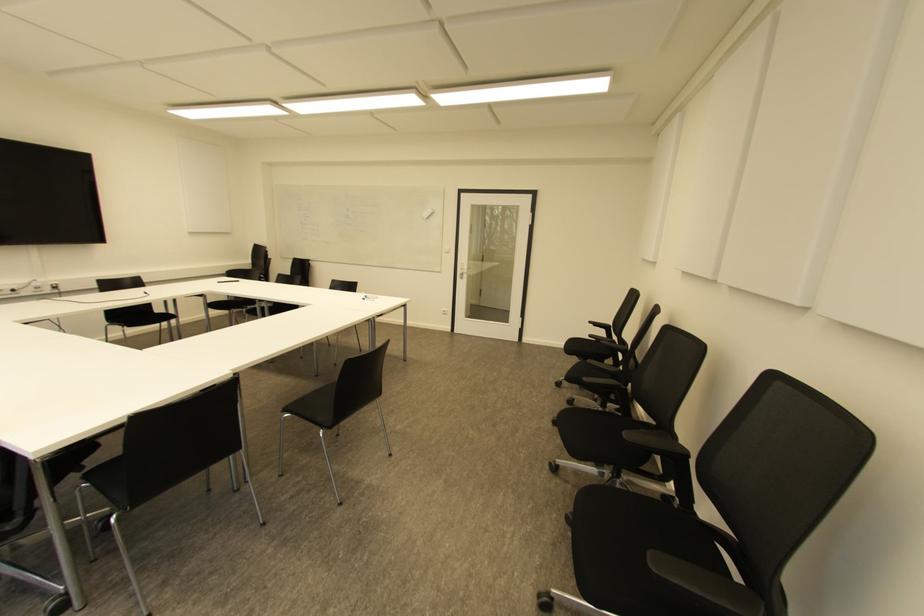
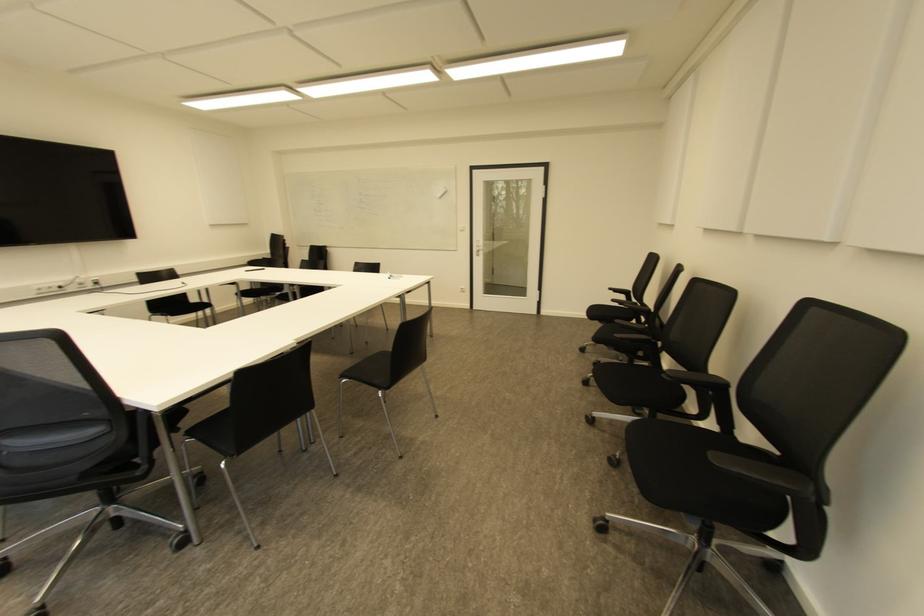
Which direction would the cameraman need to move to produce the second image?

The cameraman walked toward left, backward.